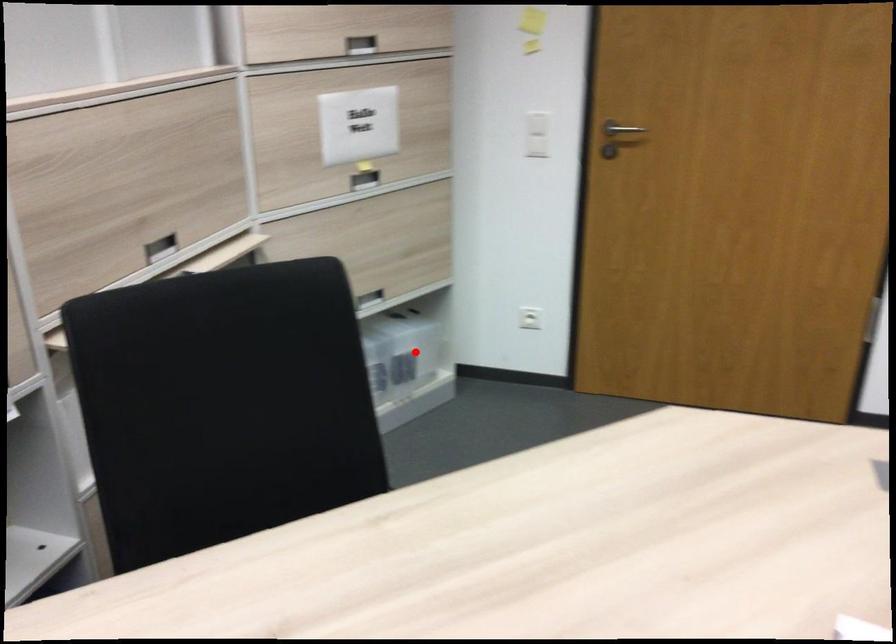
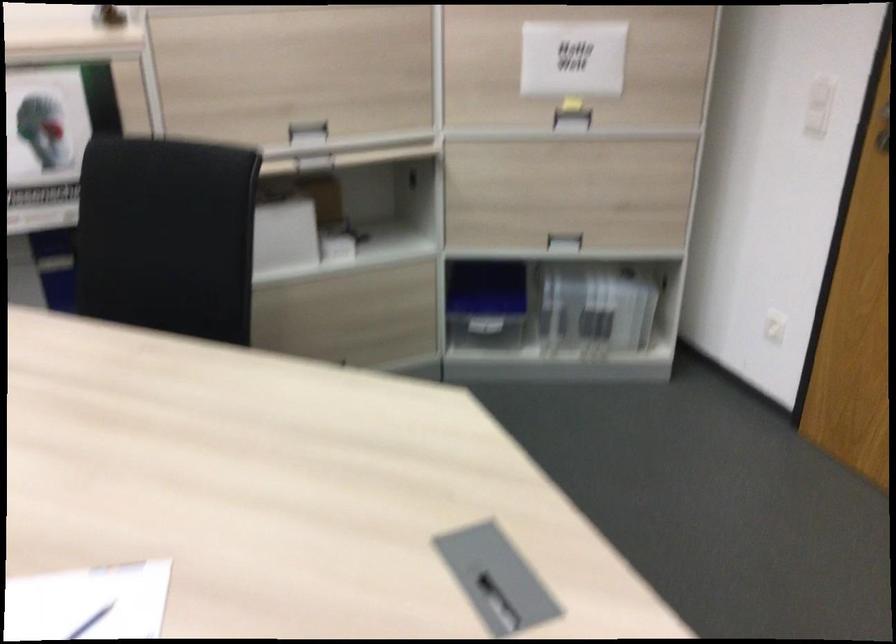
The point at the highlighted location is marked in the first image. Where is the corresponding point in the second image?

(596, 308)